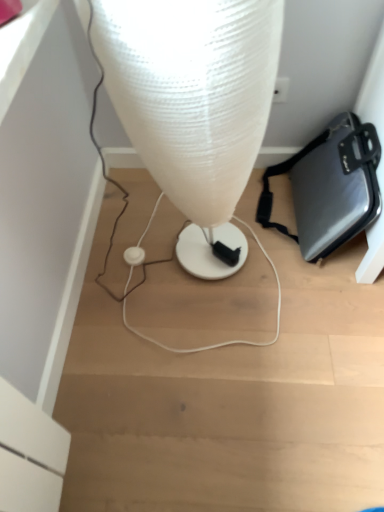
Question: Would you say metallic gray briefcase at lower right is to the left or to the right of translucent plastic lamp at center in the picture?

Choices:
 (A) left
 (B) right

Answer: (B)

Question: From a real-world perspective, is metallic gray briefcase at lower right positioned above or below translucent plastic lamp at center?

Choices:
 (A) below
 (B) above

Answer: (A)

Question: Which object is positioned farthest from the metallic gray briefcase at lower right?

Choices:
 (A) translucent plastic lamp at center
 (B) white plastic earphone at center

Answer: (B)

Question: Which is nearer to the white plastic earphone at center?

Choices:
 (A) translucent plastic lamp at center
 (B) metallic gray briefcase at lower right

Answer: (A)